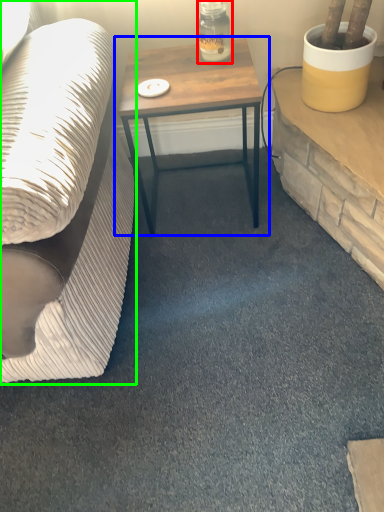
Question: Which object is the farthest from bottle (highlighted by a red box)? Choose among these: table (highlighted by a blue box) or studio couch (highlighted by a green box).

Choices:
 (A) table
 (B) studio couch

Answer: (B)